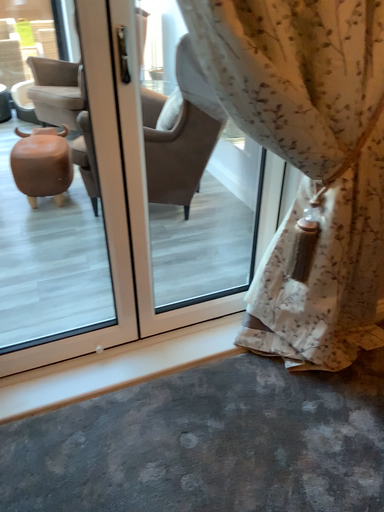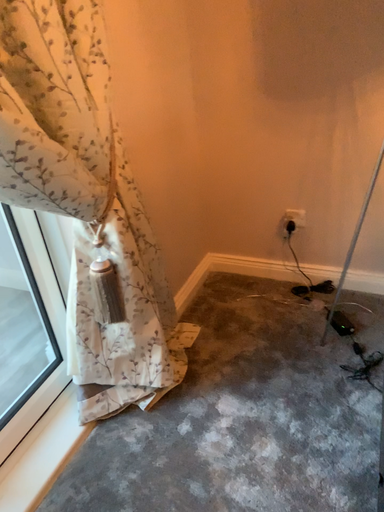
Question: How did the camera likely rotate when shooting the video?

Choices:
 (A) rotated upward
 (B) rotated downward

Answer: (A)